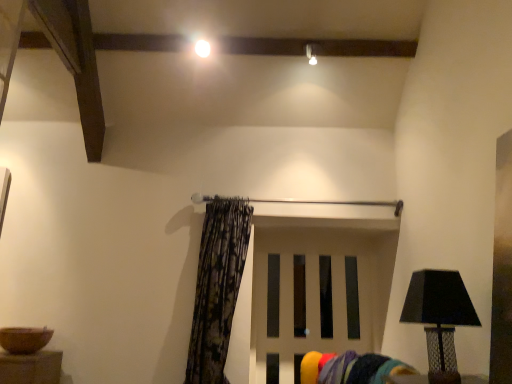
What do you see at coordinates (217, 287) in the screenshot? This screenshot has width=512, height=384. I see `printed fabric curtain at center` at bounding box center [217, 287].

Where is `black textured lamp at right`? black textured lamp at right is located at coordinates (438, 302).

Looking at this image, what is the approximate width of white matte door at center?

white matte door at center is 2.39 inches in width.

Identify the location of white matte door at center. (314, 297).

Where is `printed fabric curtain at center`? This screenshot has height=384, width=512. printed fabric curtain at center is located at coordinates coord(217,287).

Does printed fabric curtain at center turn towards velvet yellow swivel chair at lower center?

No, printed fabric curtain at center does not turn towards velvet yellow swivel chair at lower center.

The height and width of the screenshot is (384, 512). Identify the location of curtain located on the left of velvet yellow swivel chair at lower center. (x=217, y=287).

Between printed fabric curtain at center and velvet yellow swivel chair at lower center, which one has larger width?

printed fabric curtain at center.

Considering the relative positions of printed fabric curtain at center and white matte door at center in the image provided, is printed fabric curtain at center to the left or to the right of white matte door at center?

printed fabric curtain at center is positioned on white matte door at center's left side.

Considering the relative positions of printed fabric curtain at center and white matte door at center in the image provided, is printed fabric curtain at center in front of white matte door at center?

Yes, it is in front of white matte door at center.

Between printed fabric curtain at center and white matte door at center, which one has smaller width?

white matte door at center.

Is there a large distance between printed fabric curtain at center and white matte door at center?

printed fabric curtain at center is actually quite close to white matte door at center.

From a real-world perspective, is white matte door at center on white glossy light bulb at upper center?

No, from a real-world perspective, white matte door at center is not on top of white glossy light bulb at upper center.

Is white matte door at center in front of or behind white glossy light bulb at upper center in the image?

In the image, white matte door at center appears behind white glossy light bulb at upper center.

Would you say white matte door at center is outside white glossy light bulb at upper center?

Yes, white matte door at center is not within white glossy light bulb at upper center.

Is white matte door at center oriented away from white glossy light bulb at upper center?

No, white matte door at center is not facing away from white glossy light bulb at upper center.

How far apart are black textured lamp at right and printed fabric curtain at center?

The distance of black textured lamp at right from printed fabric curtain at center is 1.31 meters.

Between black textured lamp at right and printed fabric curtain at center, which one has larger width?

Wider between the two is printed fabric curtain at center.

Is black textured lamp at right closer to the viewer compared to printed fabric curtain at center?

Yes, black textured lamp at right is in front of printed fabric curtain at center.

Considering the sizes of objects black textured lamp at right and printed fabric curtain at center in the image provided, who is bigger, black textured lamp at right or printed fabric curtain at center?

Bigger between the two is printed fabric curtain at center.

From the image's perspective, who appears lower, velvet yellow swivel chair at lower center or black textured lamp at right?

velvet yellow swivel chair at lower center is shown below in the image.

Is there a large distance between velvet yellow swivel chair at lower center and black textured lamp at right?

velvet yellow swivel chair at lower center is actually quite close to black textured lamp at right.

Considering the sizes of white matte door at center and printed fabric curtain at center in the image, is white matte door at center bigger or smaller than printed fabric curtain at center?

Considering their sizes, white matte door at center takes up less space than printed fabric curtain at center.

Is white matte door at center facing away from printed fabric curtain at center?

white matte door at center is not turned away from printed fabric curtain at center.

Between point (252, 326) and point (203, 257), which one is positioned in front?

The point (203, 257) is more forward.

From a real-world perspective, who is located lower, white matte door at center or printed fabric curtain at center?

white matte door at center, from a real-world perspective.

Which is behind, velvet yellow swivel chair at lower center or white matte door at center?

white matte door at center is further away from the camera.

Is velvet yellow swivel chair at lower center facing towards white matte door at center?

No.

Would you say velvet yellow swivel chair at lower center is outside white matte door at center?

Yes, velvet yellow swivel chair at lower center is not within white matte door at center.

Between velvet yellow swivel chair at lower center and white matte door at center, which one has larger size?

white matte door at center.

Locate an element on the screen. The height and width of the screenshot is (384, 512). curtain lying on the left of velvet yellow swivel chair at lower center is located at coordinates (217, 287).

This screenshot has width=512, height=384. Identify the location of door located behind the printed fabric curtain at center. (314, 297).

Considering their positions, is printed fabric curtain at center positioned further to white matte door at center than white glossy light bulb at upper center?

white glossy light bulb at upper center lies further to white matte door at center than the other object.

Looking at the image, which one is located closer to white glossy light bulb at upper center, white matte door at center or black textured lamp at right?

white matte door at center.

From the image, which object appears to be farther from printed fabric curtain at center, black textured lamp at right or velvet yellow swivel chair at lower center?

black textured lamp at right lies further to printed fabric curtain at center than the other object.

From the image, which object appears to be nearer to printed fabric curtain at center, black textured lamp at right or white matte door at center?

white matte door at center is positioned closer to the anchor printed fabric curtain at center.

Estimate the real-world distances between objects in this image. Which object is further from white matte door at center, white glossy light bulb at upper center or black textured lamp at right?

The object further to white matte door at center is white glossy light bulb at upper center.

Estimate the real-world distances between objects in this image. Which object is closer to white glossy light bulb at upper center, black textured lamp at right or velvet yellow swivel chair at lower center?

black textured lamp at right.

Which object lies further to the anchor point printed fabric curtain at center, white matte door at center or white glossy light bulb at upper center?

Among the two, white glossy light bulb at upper center is located further to printed fabric curtain at center.

When comparing their distances from velvet yellow swivel chair at lower center, does black textured lamp at right or white glossy light bulb at upper center seem further?

The object further to velvet yellow swivel chair at lower center is white glossy light bulb at upper center.

Identify the location of lamp between white glossy light bulb at upper center and white matte door at center in the vertical direction. (438, 302).

Find the location of a particular element. curtain located between black textured lamp at right and white matte door at center in the depth direction is located at coordinates (217, 287).

Locate an element on the screen. curtain located between velvet yellow swivel chair at lower center and white matte door at center in the depth direction is located at coordinates (217, 287).

You are a GUI agent. You are given a task and a screenshot of the screen. Output one action in this format:
    pyautogui.click(x=<x>, y=<y>)
    Task: Click on the swivel chair located between black textured lamp at right and white matte door at center in the depth direction
    
    Given the screenshot: What is the action you would take?
    pyautogui.click(x=350, y=368)